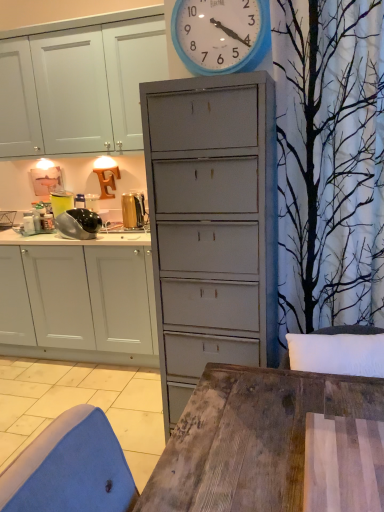
Where is `free space below shiny metallic food processor at left, which appears as the second appliance when viewed from the right (from a real-world perspective)`? free space below shiny metallic food processor at left, which appears as the second appliance when viewed from the right (from a real-world perspective) is located at coordinates (74, 241).